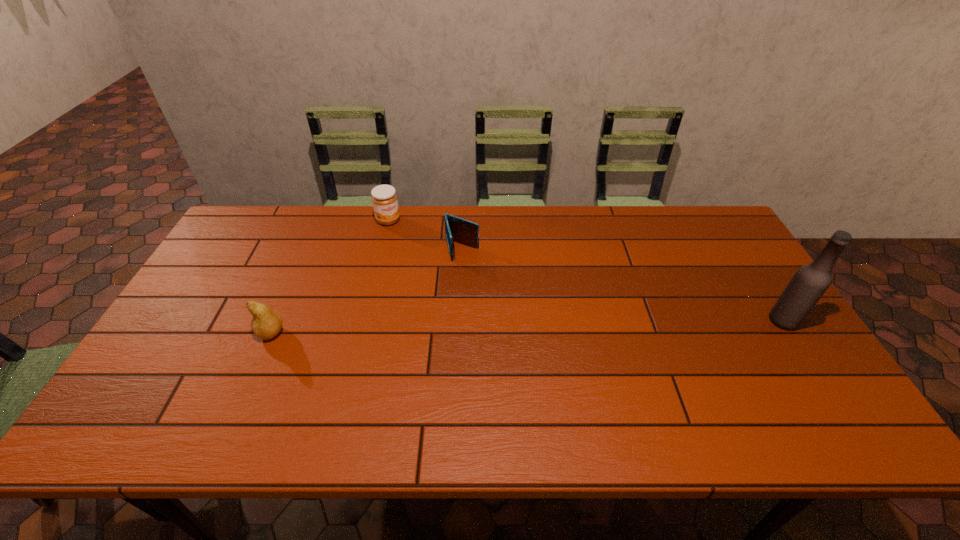
Where is `free region at the far left corner of the desktop`? free region at the far left corner of the desktop is located at coordinates (264, 224).

This screenshot has height=540, width=960. I want to click on free location at the far right corner, so click(x=712, y=238).

Locate an element on the screen. free space at the near right corner is located at coordinates (772, 386).

Find the location of `free space that is in between the jam and the leftmost object`. free space that is in between the jam and the leftmost object is located at coordinates (330, 276).

You are a GUI agent. You are given a task and a screenshot of the screen. Output one action in this format:
    pyautogui.click(x=<x>, y=<y>)
    Task: Click on the free space between the farthest object and the rightmost object
    This screenshot has height=540, width=960.
    Given the screenshot: What is the action you would take?
    pyautogui.click(x=586, y=271)

You are a GUI agent. You are given a task and a screenshot of the screen. Output one action in this format:
    pyautogui.click(x=<x>, y=<y>)
    Task: Click on the free space between the pear and the jam
    The width and height of the screenshot is (960, 540).
    Given the screenshot: What is the action you would take?
    pyautogui.click(x=330, y=276)

Find the location of a particular element. This screenshot has height=540, width=960. empty location between the shortest object and the beer bottle is located at coordinates pos(623,285).

Where is `free space between the second object from left to right and the leftmost object`? free space between the second object from left to right and the leftmost object is located at coordinates (330, 276).

You are a GUI agent. You are given a task and a screenshot of the screen. Output one action in this format:
    pyautogui.click(x=<x>, y=<y>)
    Task: Click on the unoccupied area between the second object from left to right and the wallet
    This screenshot has width=960, height=540.
    Given the screenshot: What is the action you would take?
    pyautogui.click(x=425, y=235)

This screenshot has height=540, width=960. What are the coordinates of `vacant area that lies between the farthest object and the leftmost object` in the screenshot? It's located at (330, 276).